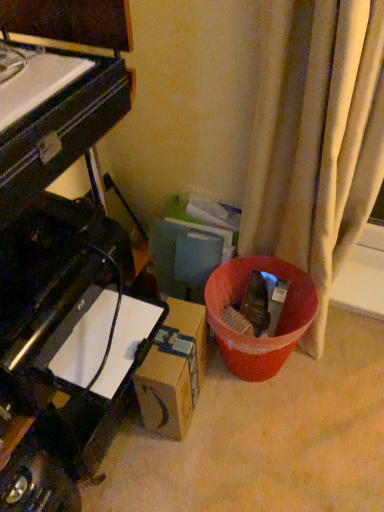
Question: Considering the positions of brown cardboard box at lower center and black glossy piano at left in the image, is brown cardboard box at lower center bigger or smaller than black glossy piano at left?

Choices:
 (A) small
 (B) big

Answer: (A)

Question: Is brown cardboard box at lower center in front of or behind black glossy piano at left in the image?

Choices:
 (A) behind
 (B) front

Answer: (A)

Question: Is brown cardboard box at lower center situated inside black glossy piano at left or outside?

Choices:
 (A) outside
 (B) inside

Answer: (A)

Question: Is black glossy piano at left taller or shorter than brown cardboard box at lower center?

Choices:
 (A) tall
 (B) short

Answer: (B)

Question: In terms of width, does black glossy piano at left look wider or thinner when compared to brown cardboard box at lower center?

Choices:
 (A) wide
 (B) thin

Answer: (A)

Question: Relative to brown cardboard box at lower center, is black glossy piano at left in front or behind?

Choices:
 (A) behind
 (B) front

Answer: (B)

Question: Is black glossy piano at left inside the boundaries of brown cardboard box at lower center, or outside?

Choices:
 (A) inside
 (B) outside

Answer: (B)